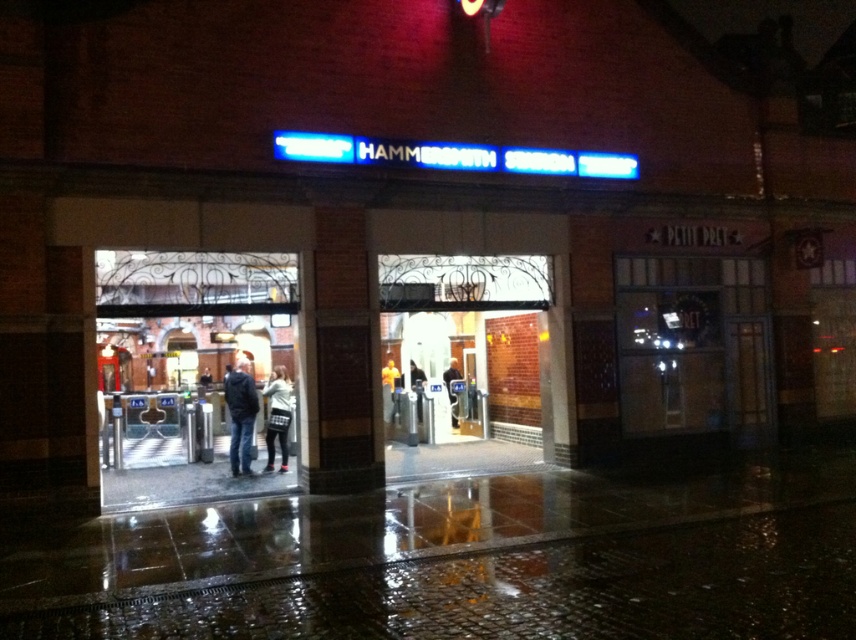
You are a person standing at the entrance of Hammersmith station. You see a white sweater at center and dark blue jeans at center. Which clothing item is closer to you?

The white sweater at center is closer to you because it is in front of the dark blue jeans at center.

Consider the image. You are standing at the entrance of Hammersmith station and want to take a photo. You notice two points marked in the image. Which point, point [372,308] or point [271,452], will appear larger in your photo?

Point [372,308] will appear larger in the photo because it is closer to the camera than point [271,452].

You are standing at the entrance of Hammersmith station and want to take a photo. There are two points you want to focus on, point 1 at coordinates point (373, 269) and point 2 at coordinates point (230, 388). Which point will appear larger in your photo?

Point 1 at coordinates point (373, 269) will appear larger in the photo because it is closer to the camera than point 2 at coordinates point (230, 388).